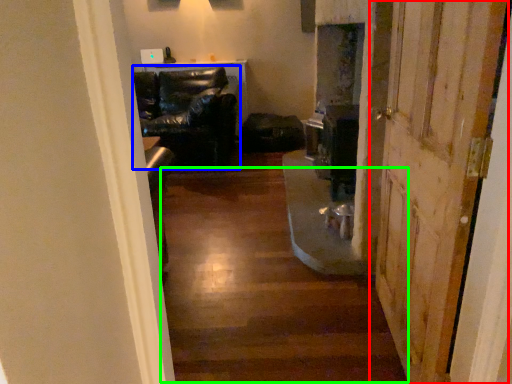
Question: Which object is the closest to the door (highlighted by a red box)? Choose among these: chair (highlighted by a blue box) or stairwell (highlighted by a green box).

Choices:
 (A) chair
 (B) stairwell

Answer: (B)